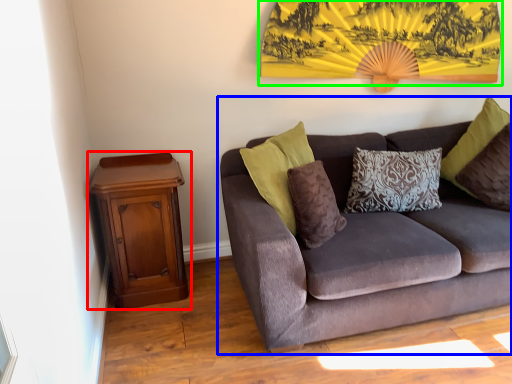
Question: Which object is the closest to the nightstand (highlighted by a red box)? Choose among these: studio couch (highlighted by a blue box) or mountain view (highlighted by a green box).

Choices:
 (A) studio couch
 (B) mountain view

Answer: (A)